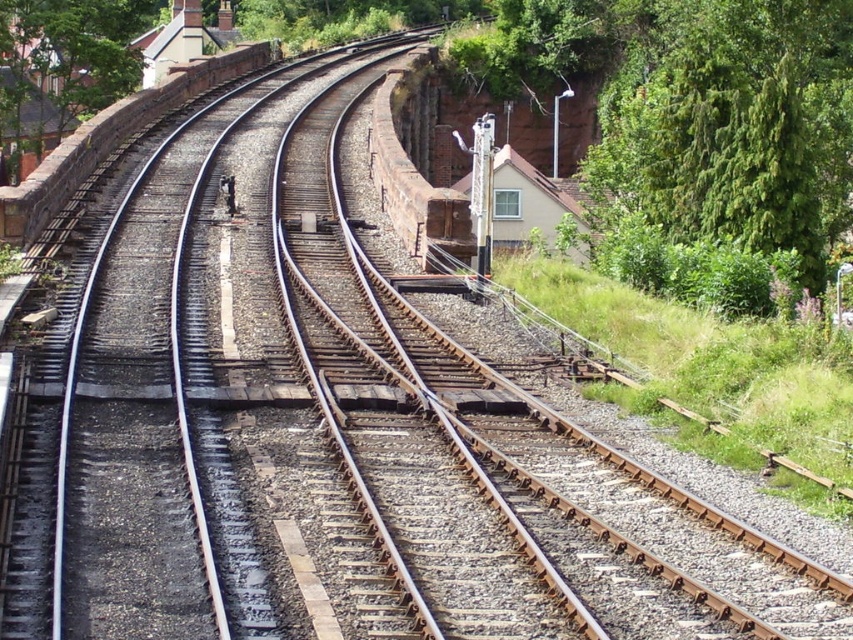
Question: Does green leafy tree at right have a smaller size compared to green leafy tree at upper left?

Choices:
 (A) no
 (B) yes

Answer: (B)

Question: Which object appears closest to the camera in this image?

Choices:
 (A) green leafy tree at right
 (B) green leafy tree at upper left

Answer: (A)

Question: Can you confirm if green leafy tree at right is smaller than green leafy tree at upper left?

Choices:
 (A) no
 (B) yes

Answer: (B)

Question: Is green leafy tree at right to the right of green leafy tree at upper left from the viewer's perspective?

Choices:
 (A) no
 (B) yes

Answer: (B)